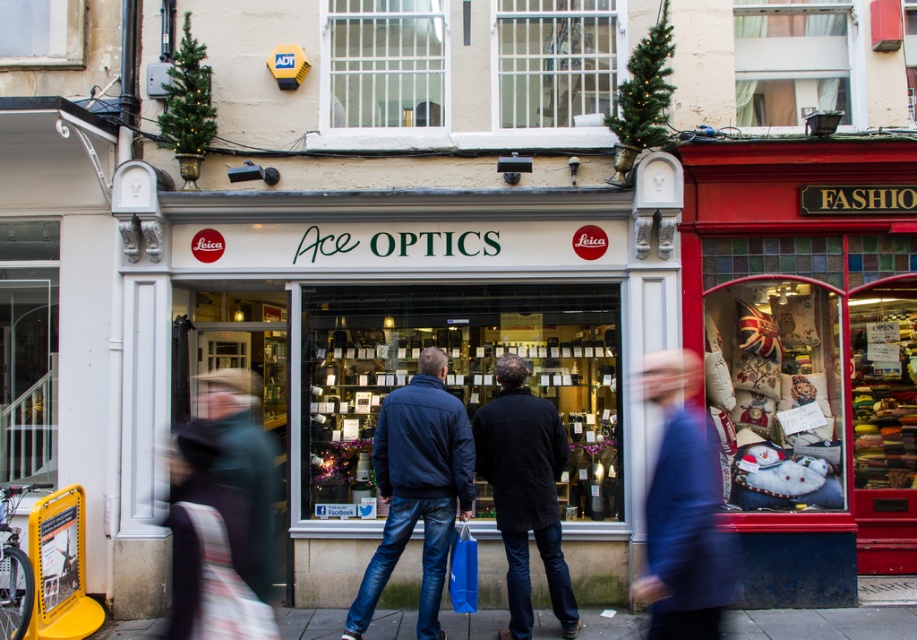
Consider the image. You are standing on the smooth concrete sidewalk at center and looking at the blue woolen coat at center. Which object is nearer to you?

The blue woolen coat at center is closer to you than the smooth concrete sidewalk at center.

You are a customer looking at the storefront displays. Which item is taller between the blue denim jeans at center and the black matte coat at center?

The blue denim jeans at center is much taller than the black matte coat at center.

You are a delivery person who needs to place a package on the smooth concrete sidewalk at center. However, there is a blue woolen coat at center in the way. Can you move the coat to the side to access the sidewalk?

The blue woolen coat at center is located above the smooth concrete sidewalk at center, so you can move the coat to the side to access the sidewalk.